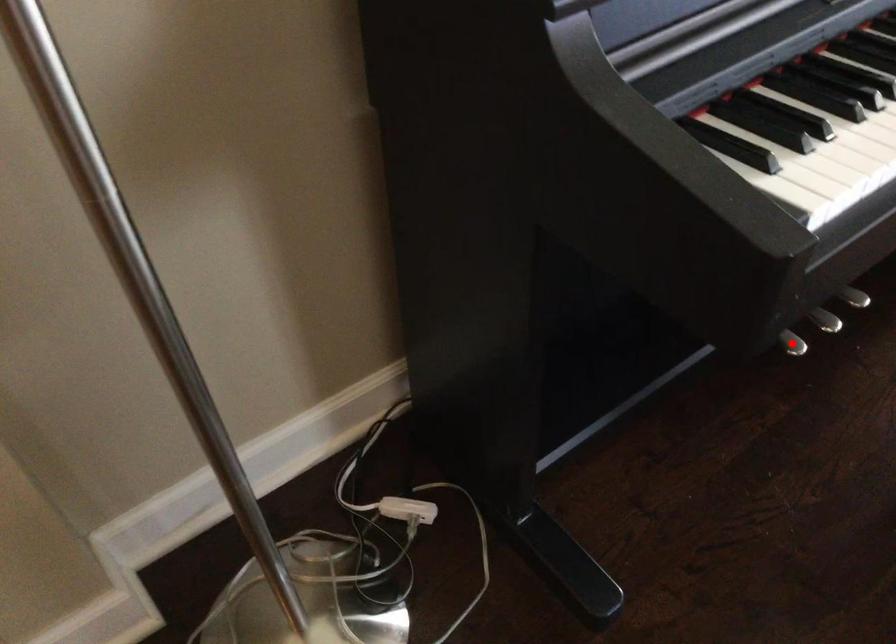
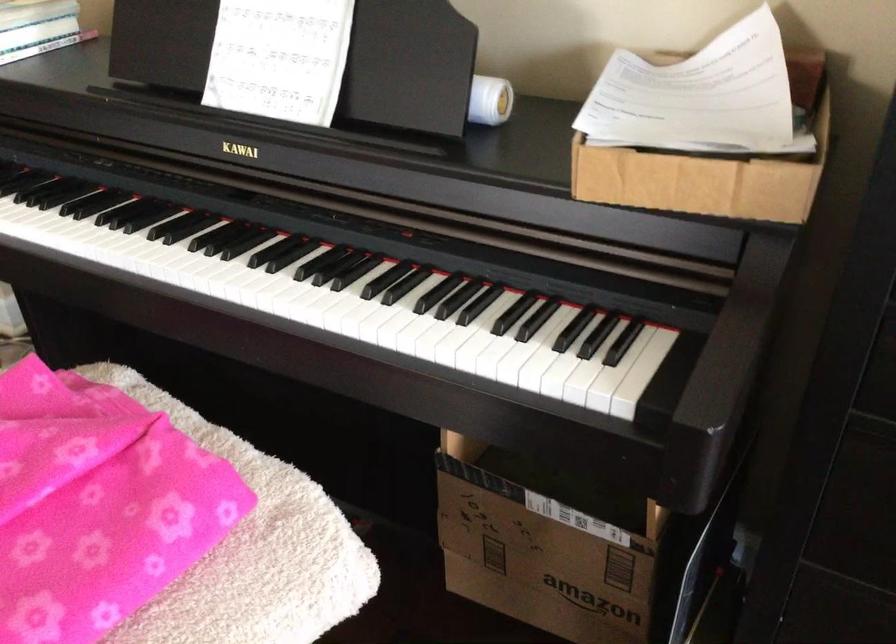
Question: I am providing you with two images of the same scene from different viewpoints. A red point is marked on the first image. At the location where the point appears in image 1, is it still visible in image 2?

Choices:
 (A) Yes
 (B) No

Answer: (B)